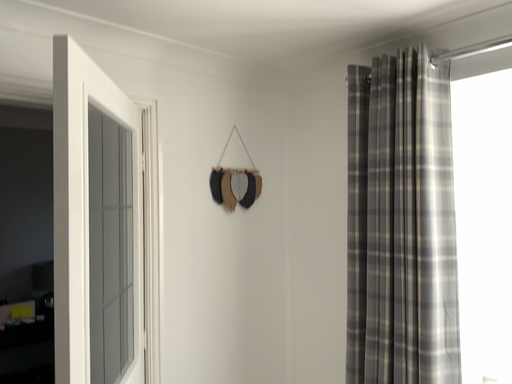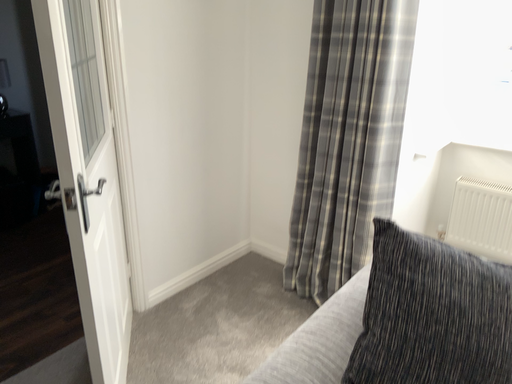
Question: How did the camera likely rotate when shooting the video?

Choices:
 (A) rotated left
 (B) rotated right

Answer: (B)